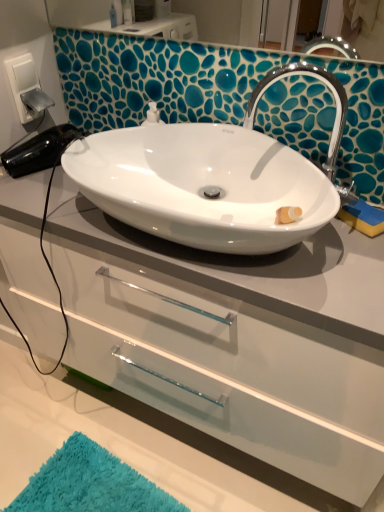
At what (x,y) coordinates should I click in order to perform the action: click on empty space that is ontop of turquoise shaggy bath mat at lower left. Please return your answer as a coordinate pair (x, y). Image resolution: width=384 pixels, height=512 pixels. Looking at the image, I should click on (91, 485).